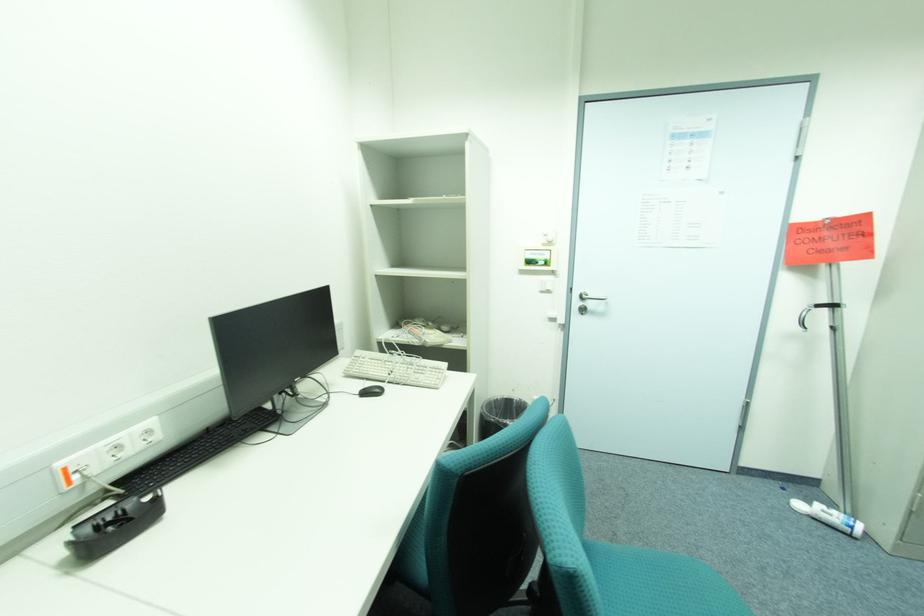
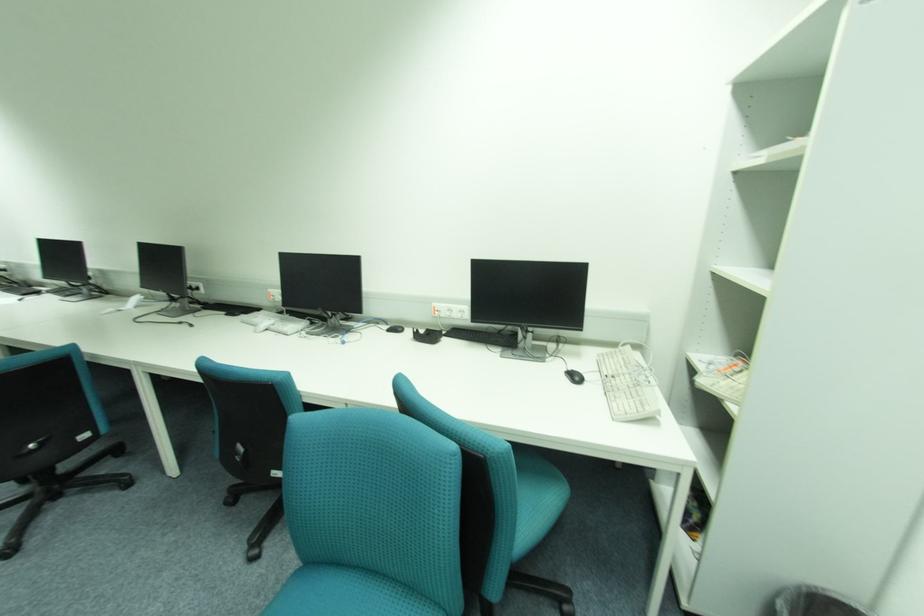
The point at (383,391) is marked in the first image. Where is the corresponding point in the second image?

(584, 379)